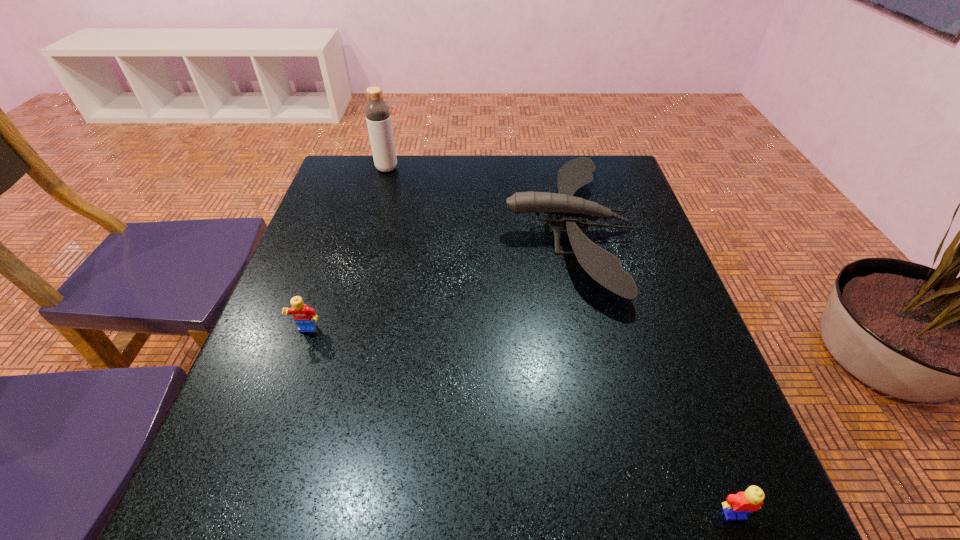
Identify the location of free space that is in between the nearer Lego and the left Lego. This screenshot has height=540, width=960. (520, 422).

The image size is (960, 540). Identify the location of empty space that is in between the left Lego and the nearest object. (520, 422).

The width and height of the screenshot is (960, 540). What are the coordinates of `empty space between the drone and the second nearest object` in the screenshot? It's located at (438, 280).

I want to click on vacant space that is in between the right Lego and the bottle, so click(x=561, y=341).

Image resolution: width=960 pixels, height=540 pixels. I want to click on unoccupied area between the third shortest object and the tallest object, so 477,199.

I want to click on empty space between the nearest object and the left Lego, so click(x=520, y=422).

Image resolution: width=960 pixels, height=540 pixels. What are the coordinates of `unoccupied position between the second tallest object and the tallest object` in the screenshot? It's located at (477, 199).

Locate an element on the screen. The width and height of the screenshot is (960, 540). the second closest object to the third object from right to left is located at coordinates (305, 317).

Locate an element on the screen. This screenshot has width=960, height=540. the second closest object to the tallest object is located at coordinates (305, 317).

The width and height of the screenshot is (960, 540). What are the coordinates of `vacant position in the image that satisfies the following two spatial constraints: 1. at the head of the second tallest object; 2. on the face of the left Lego` in the screenshot? It's located at (589, 331).